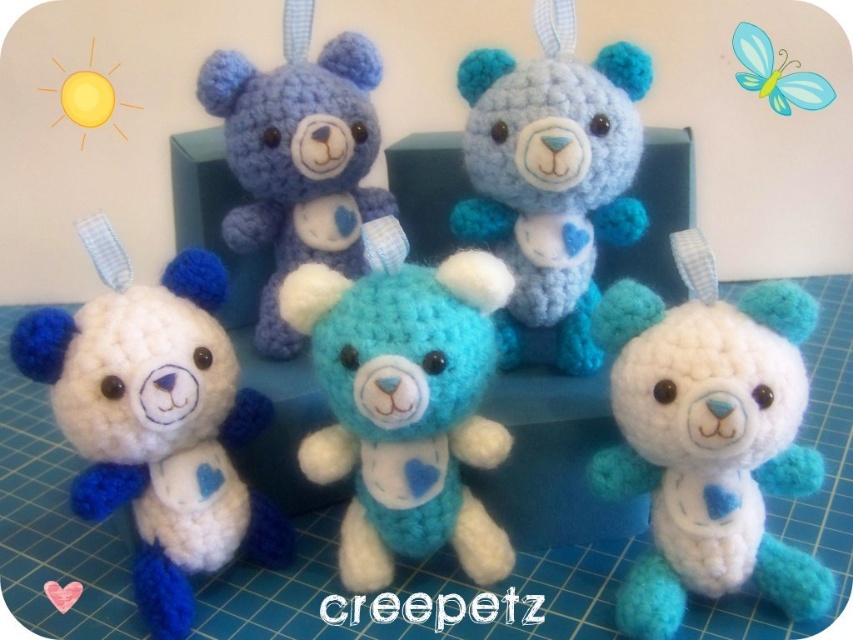
You are a toy store employee arranging these teddy bears on a shelf. You need to place the white yarn teddy bear at lower left and the teal yarn teddy bear at center side by side. Which teddy bear requires more shelf space horizontally?

The white yarn teddy bear at lower left requires more shelf space horizontally because its width surpasses that of the teal yarn teddy bear at center.

You are organizing a teddy bear display on a blue cutting mat. You have a white yarn teddy bear at lower left and a teal yarn teddy bear at center. According to the arrangement, which teddy bear is positioned lower on the mat?

The white yarn teddy bear at lower left is positioned lower on the mat than the teal yarn teddy bear at center.

You are setting up a display for a craft fair. You have two teddy bears to place on a shelf. The teal yarn teddy bear at center and the blue yarn teddy bear at upper center. Which bear should you place in the front to make the display look balanced?

The teal yarn teddy bear at center is smaller in size compared to the blue yarn teddy bear at upper center. To create a balanced display, place the smaller teal yarn teddy bear at center in front so it visually aligns with the larger blue yarn teddy bear at upper center.